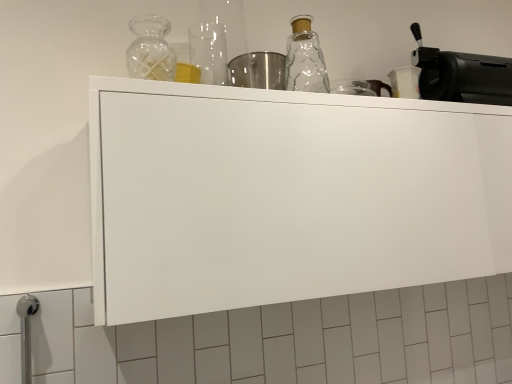
Question: From their relative heights in the image, would you say black matte coffee machine at upper right is taller or shorter than white matte cabinet at upper center?

Choices:
 (A) short
 (B) tall

Answer: (A)

Question: Is black matte coffee machine at upper right bigger or smaller than white matte cabinet at upper center?

Choices:
 (A) big
 (B) small

Answer: (B)

Question: Estimate the real-world distances between objects in this image. Which object is closer to the clear glass bottle at upper center?

Choices:
 (A) black matte coffee machine at upper right
 (B) white matte cabinet at upper center

Answer: (B)

Question: Which of these objects is positioned farthest from the white matte cabinet at upper center?

Choices:
 (A) clear glass bottle at upper center
 (B) black matte coffee machine at upper right

Answer: (B)